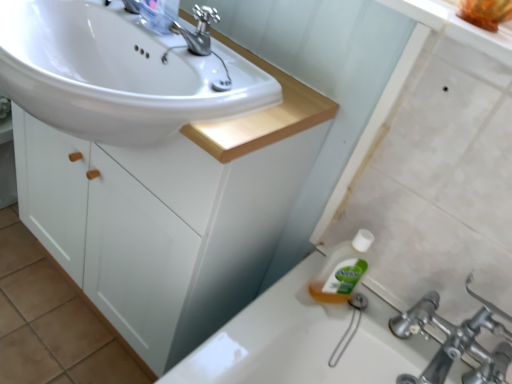
Question: Considering the relative sizes of polished metallic faucet at upper center and clear plastic bottle at upper center in the image provided, is polished metallic faucet at upper center bigger than clear plastic bottle at upper center?

Choices:
 (A) yes
 (B) no

Answer: (B)

Question: Is polished metallic faucet at upper center placed right next to clear plastic bottle at upper center?

Choices:
 (A) yes
 (B) no

Answer: (A)

Question: Is polished metallic faucet at upper center turned away from clear plastic bottle at upper center?

Choices:
 (A) no
 (B) yes

Answer: (A)

Question: From a real-world perspective, does polished metallic faucet at upper center sit lower than clear plastic bottle at upper center?

Choices:
 (A) no
 (B) yes

Answer: (B)

Question: Are polished metallic faucet at upper center and clear plastic bottle at upper center located far from each other?

Choices:
 (A) no
 (B) yes

Answer: (A)

Question: Is polished metallic faucet at upper center thinner than clear plastic bottle at upper center?

Choices:
 (A) no
 (B) yes

Answer: (A)

Question: Does clear plastic bottle at upper center appear on the left side of white glossy sink at upper left?

Choices:
 (A) no
 (B) yes

Answer: (A)

Question: Is clear plastic bottle at upper center thinner than white glossy sink at upper left?

Choices:
 (A) yes
 (B) no

Answer: (A)

Question: Is clear plastic bottle at upper center next to white glossy sink at upper left and touching it?

Choices:
 (A) yes
 (B) no

Answer: (B)

Question: Is clear plastic bottle at upper center positioned with its back to white glossy sink at upper left?

Choices:
 (A) yes
 (B) no

Answer: (B)

Question: Does clear plastic bottle at upper center have a larger size compared to white glossy sink at upper left?

Choices:
 (A) yes
 (B) no

Answer: (B)

Question: Is clear plastic bottle at upper center taller than white glossy sink at upper left?

Choices:
 (A) no
 (B) yes

Answer: (B)

Question: Is white glossy sink at upper left taller than polished metallic faucet at upper center?

Choices:
 (A) no
 (B) yes

Answer: (B)